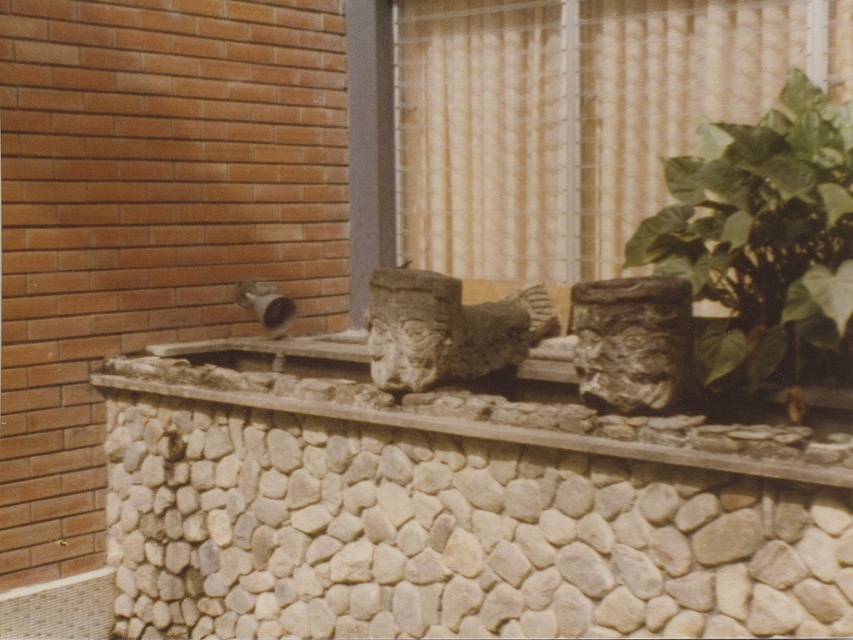
Question: Which point is closer to the camera?

Choices:
 (A) matte stone wall at center
 (B) green leafy plant at right
 (C) matte glass window at center

Answer: (A)

Question: Considering the relative positions of green leafy plant at right and matte stone wall at center in the image provided, where is green leafy plant at right located with respect to matte stone wall at center?

Choices:
 (A) left
 (B) right

Answer: (B)

Question: Is the position of green leafy plant at right more distant than that of matte stone wall at center?

Choices:
 (A) yes
 (B) no

Answer: (A)

Question: Is matte glass window at center positioned in front of matte stone wall at center?

Choices:
 (A) no
 (B) yes

Answer: (A)

Question: Estimate the real-world distances between objects in this image. Which object is farther from the matte stone wall at center?

Choices:
 (A) green leafy plant at right
 (B) matte glass window at center

Answer: (B)

Question: Which object appears farthest from the camera in this image?

Choices:
 (A) green leafy plant at right
 (B) matte glass window at center
 (C) matte stone wall at center

Answer: (B)